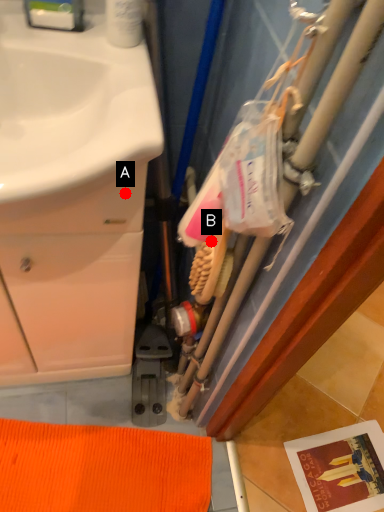
Question: Two points are circled on the image, labeled by A and B beside each circle. Which point is closer to the camera taking this photo?

Choices:
 (A) A is closer
 (B) B is closer

Answer: (A)